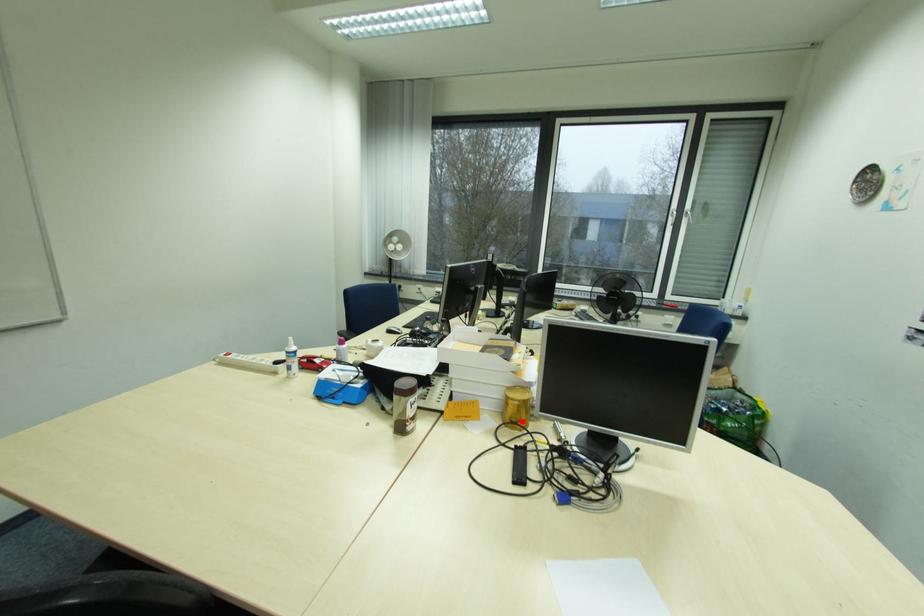
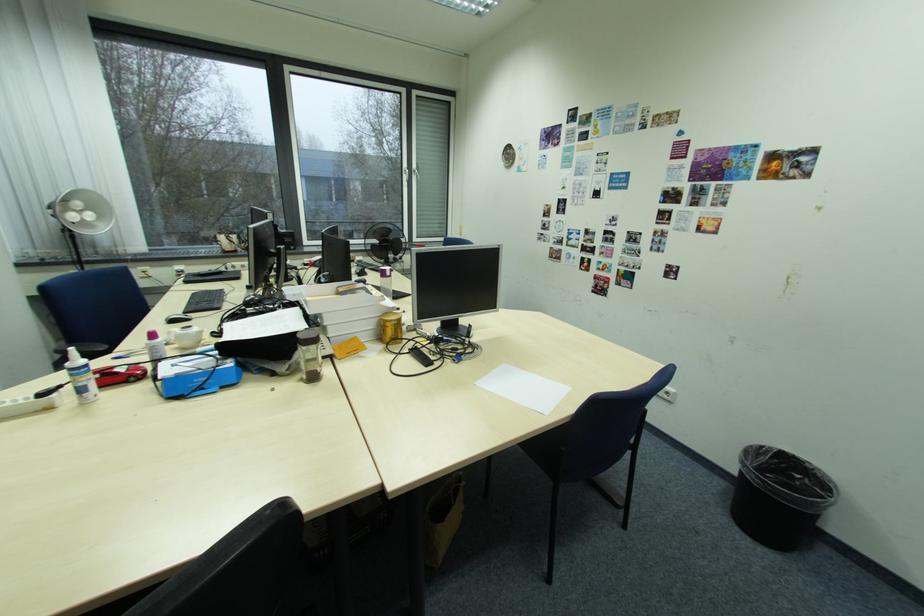
Where in the second image is the point corresponding to the highlighted location from the first image?

(400, 339)